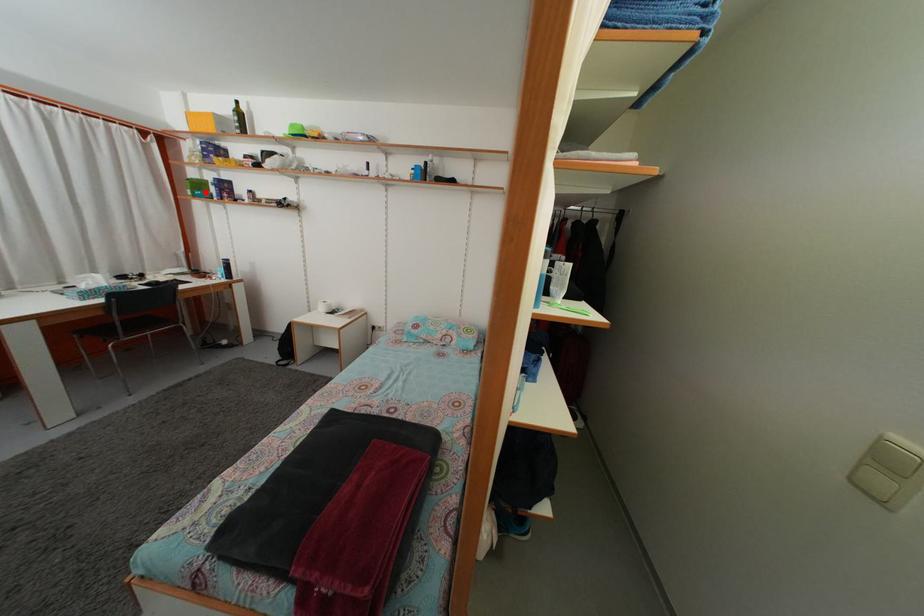
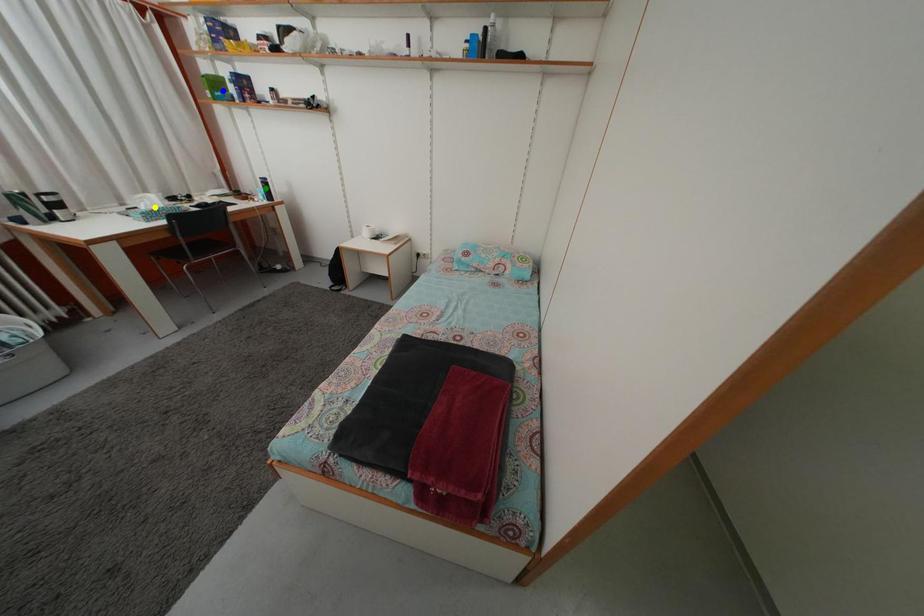
Question: I am providing you with two images of the same scene from different viewpoints. A red point is marked on the first image. You are given multiple points on the second image. Which spot in image 2 lines up with the point in image 1?

Choices:
 (A) green point
 (B) yellow point
 (C) blue point

Answer: (C)